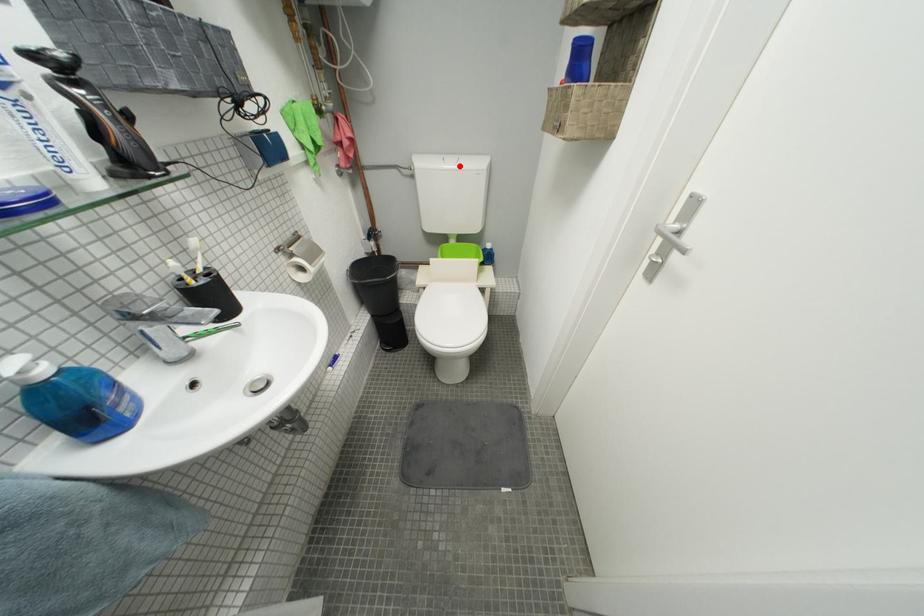
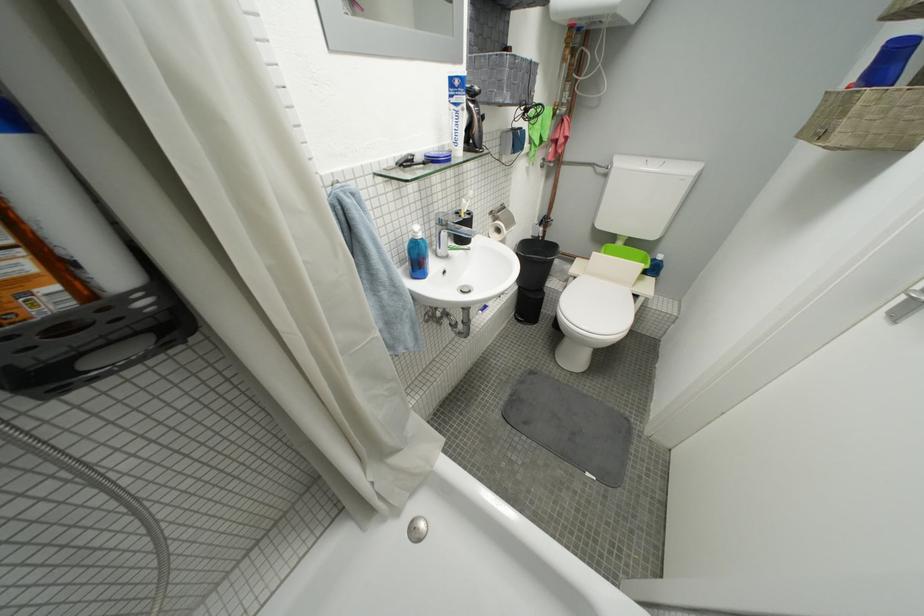
In the second image, find the point that corresponds to the highlighted location in the first image.

(662, 169)